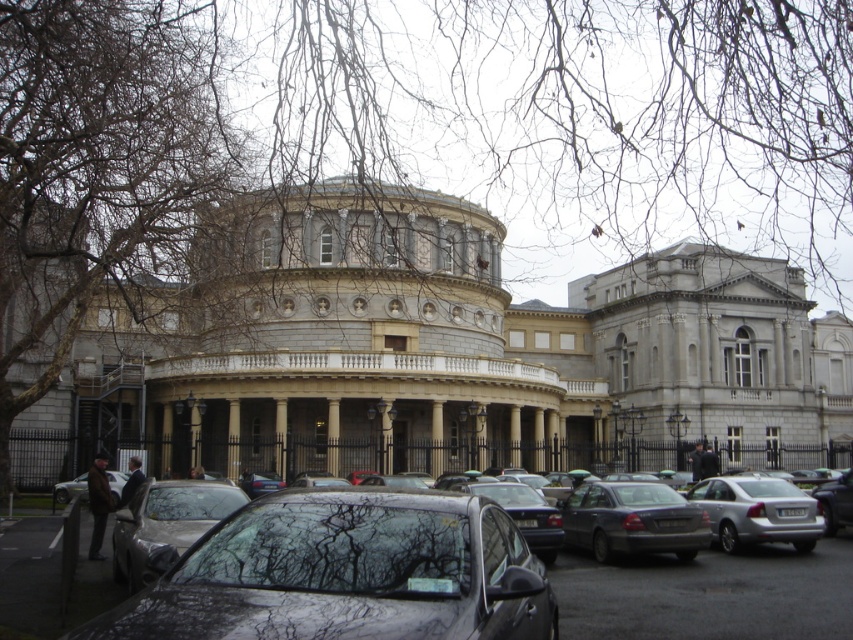
Identify the location of matte gray sedan at center. The height and width of the screenshot is (640, 853). (631, 520).

Between point (590, 483) and point (86, 472), which one is positioned behind?

Point (86, 472)

Locate an element on the screen. Image resolution: width=853 pixels, height=640 pixels. matte gray sedan at center is located at coordinates (631, 520).

Does gray stone palace at center appear under silver metallic sedan at lower right?

No, gray stone palace at center is not below silver metallic sedan at lower right.

Who is more distant from viewer, [265,282] or [753,477]?

Positioned behind is point [265,282].

At what (x,y) coordinates should I click in order to perform the action: click on gray stone palace at center. Please return your answer as a coordinate pair (x, y). Looking at the image, I should click on (439, 353).

Can you confirm if shiny black sedan at center is positioned below silver metallic sedan at lower right?

Actually, shiny black sedan at center is above silver metallic sedan at lower right.

Which is behind, point (334, 604) or point (811, 545)?

Point (811, 545)

Find the location of a particular element. This screenshot has width=853, height=640. shiny black sedan at center is located at coordinates (345, 573).